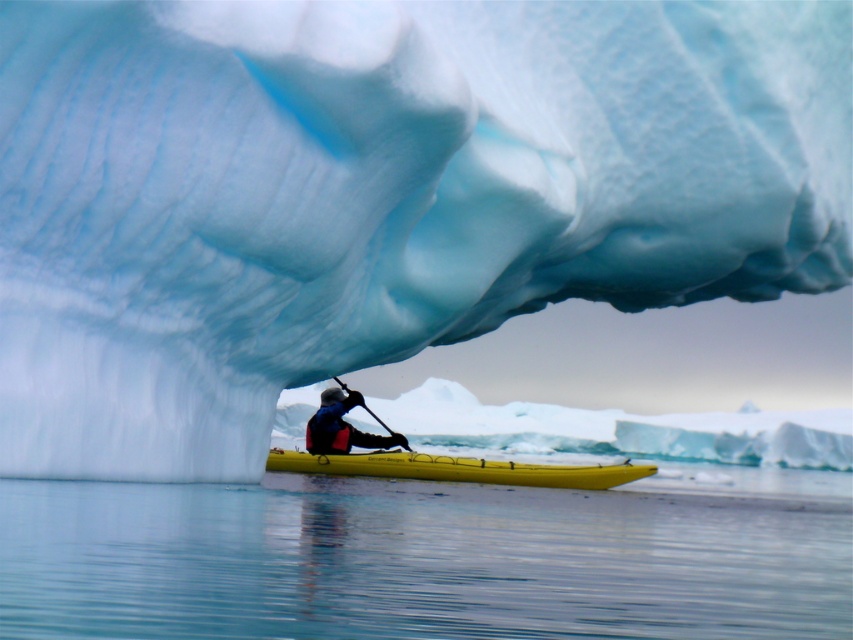
You are a kayaker who wants to reach the iceberg ahead. You see the transparent water at lower center and the yellow matte canoe at center. Which direction should you paddle to move towards the iceberg?

The transparent water at lower center is to the left of the yellow matte canoe at center. Since the kayak is on the yellow matte canoe at center, you should paddle towards the left to move towards the transparent water at lower center, which is in the direction of the iceberg.

You are a wildlife photographer planning to capture the reflection of the yellow matte canoe at center in the transparent water at lower center. Based on the scene, can you confirm if the reflection will be fully visible?

The transparent water at lower center has a lesser height compared to yellow matte canoe at center, so the reflection of the yellow matte canoe at center will be fully visible in the transparent water at lower center.

You are a drone operator tasked with capturing aerial footage of the yellow matte canoe at center. The drone must maintain a safe distance of 10 meters from the canoe to avoid disturbing the kayaker. Given the coordinates of the canoe at point 0.733, 0.535, what is the safest direction to position the drone while ensuring it stays within the visible frame of the image?

The safest direction to position the drone would be directly above the yellow matte canoe at center since maintaining a vertical position ensures the required 10 meters distance while staying within the frame. However, exact positioning may depend on the image scale and drone capabilities.